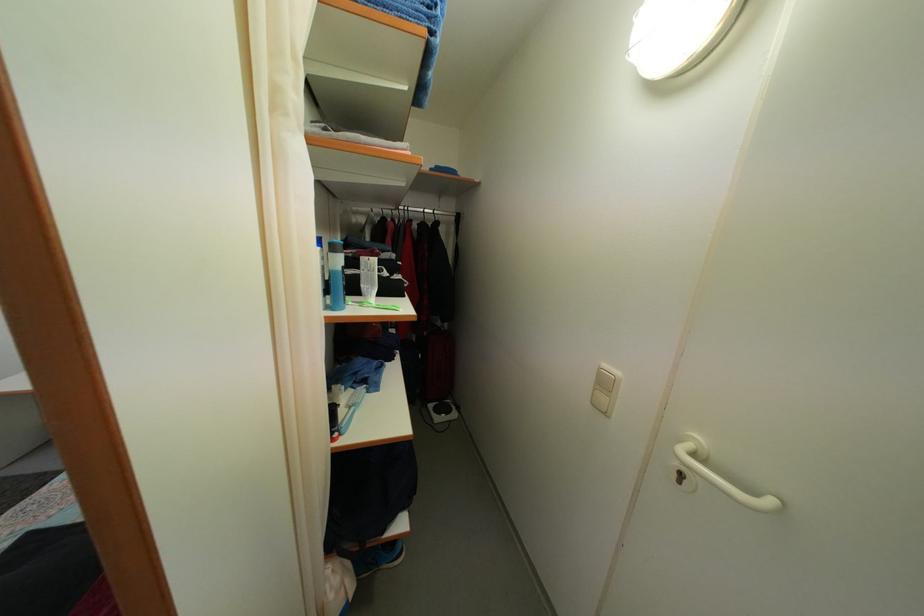
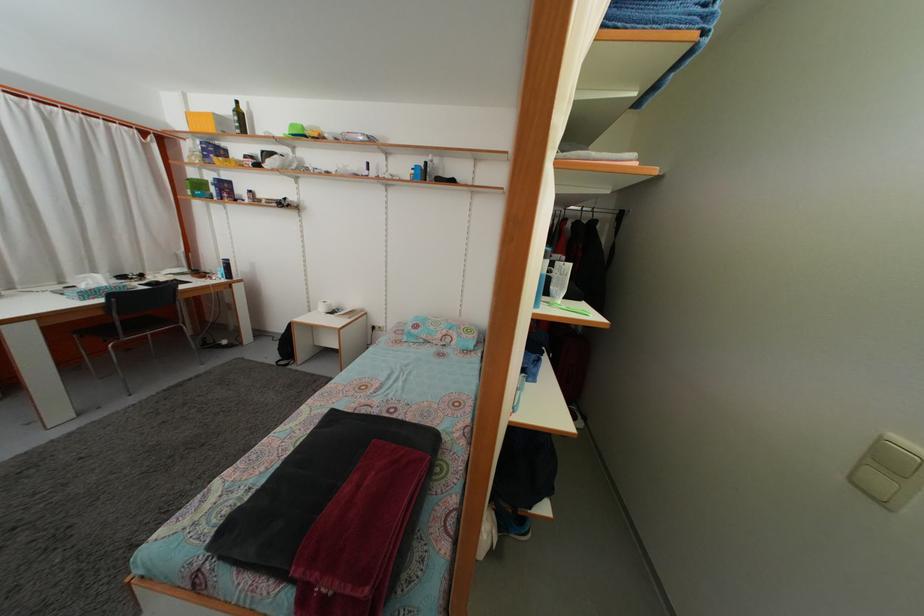
Locate, in the second image, the point that corresponds to the point at 611,373 in the first image.

(903, 445)